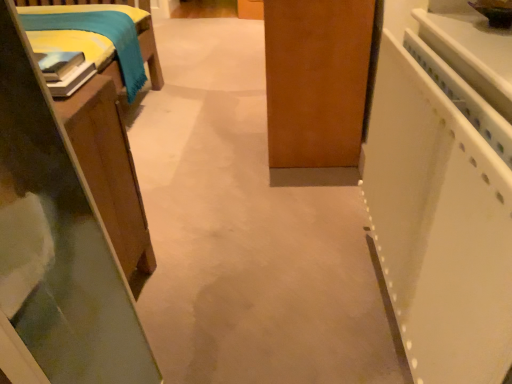
Question: Could you tell me if wooden bed frame at left, the second furniture from the bottom, is turned towards white glossy counter top at right?

Choices:
 (A) no
 (B) yes

Answer: (A)

Question: Considering the relative positions of wooden bed frame at left, the second furniture from the bottom, and white glossy counter top at right in the image provided, is wooden bed frame at left, the second furniture from the bottom, to the right of white glossy counter top at right from the viewer's perspective?

Choices:
 (A) no
 (B) yes

Answer: (A)

Question: Can you confirm if wooden bed frame at left, the 1th furniture viewed from the top, is taller than white glossy counter top at right?

Choices:
 (A) no
 (B) yes

Answer: (B)

Question: Is wooden bed frame at left, the 1th furniture viewed from the top, looking in the opposite direction of white glossy counter top at right?

Choices:
 (A) no
 (B) yes

Answer: (A)

Question: Is wooden bed frame at left, the second furniture from the bottom, placed right next to white glossy counter top at right?

Choices:
 (A) no
 (B) yes

Answer: (A)

Question: Does wooden bed frame at left, the 1th furniture viewed from the top, have a larger size compared to white glossy counter top at right?

Choices:
 (A) no
 (B) yes

Answer: (A)

Question: Does white plastic cabinet at right have a smaller size compared to wooden table at left, which is counted as the 2th furniture, starting from the top?

Choices:
 (A) no
 (B) yes

Answer: (B)

Question: Is white plastic cabinet at right facing towards wooden table at left, which is counted as the 2th furniture, starting from the top?

Choices:
 (A) yes
 (B) no

Answer: (A)

Question: Does white plastic cabinet at right have a larger size compared to wooden table at left, positioned as the first furniture in bottom-to-top order?

Choices:
 (A) no
 (B) yes

Answer: (A)

Question: Would you say wooden table at left, which is counted as the 2th furniture, starting from the top, is part of white plastic cabinet at right's contents?

Choices:
 (A) yes
 (B) no

Answer: (B)

Question: Does white plastic cabinet at right have a greater width compared to wooden table at left, which is counted as the 2th furniture, starting from the top?

Choices:
 (A) yes
 (B) no

Answer: (B)

Question: From a real-world perspective, is white plastic cabinet at right physically below wooden table at left, which is counted as the 2th furniture, starting from the top?

Choices:
 (A) no
 (B) yes

Answer: (A)

Question: Can you confirm if white glossy counter top at right is positioned to the left of wooden bed frame at left, the 1th furniture viewed from the top?

Choices:
 (A) no
 (B) yes

Answer: (A)